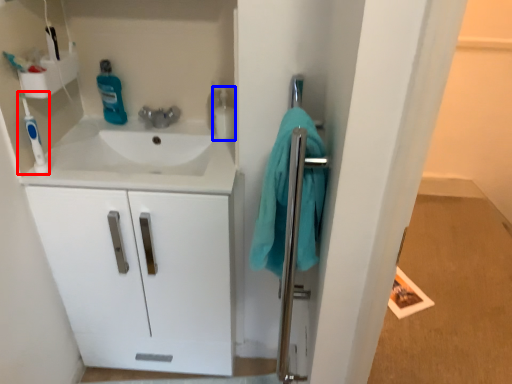
Question: Which point is further to the camera, toothbrush (highlighted by a red box) or cleaning product (highlighted by a blue box)?

Choices:
 (A) toothbrush
 (B) cleaning product

Answer: (B)